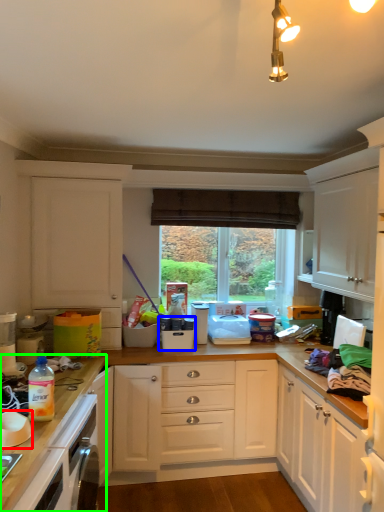
Question: Estimate the real-world distances between objects in this image. Which object is farther from bowl (highlighted by a red box), appliance (highlighted by a blue box) or countertop (highlighted by a green box)?

Choices:
 (A) appliance
 (B) countertop

Answer: (A)